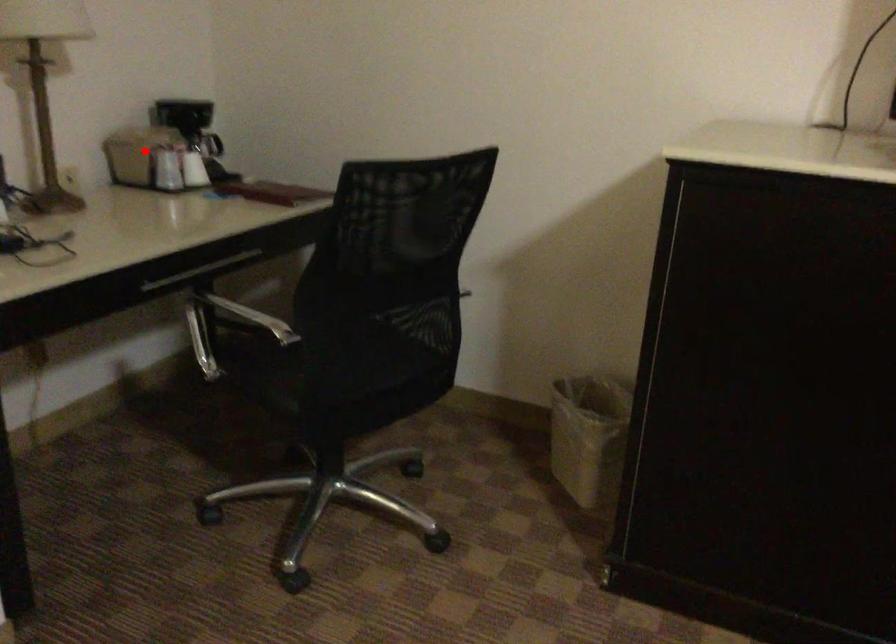
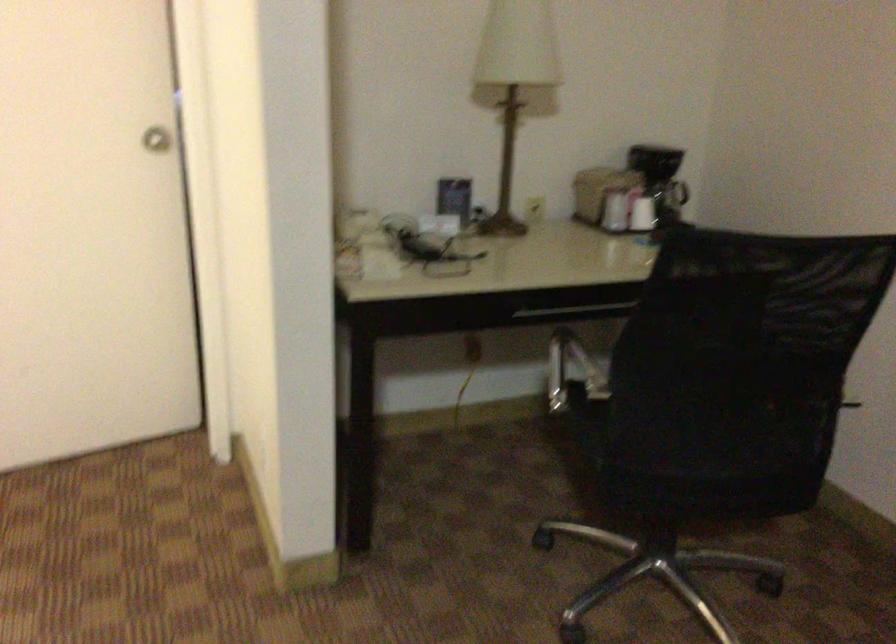
Find the pixel in the second image that matches the highlighted location in the first image.

(598, 192)